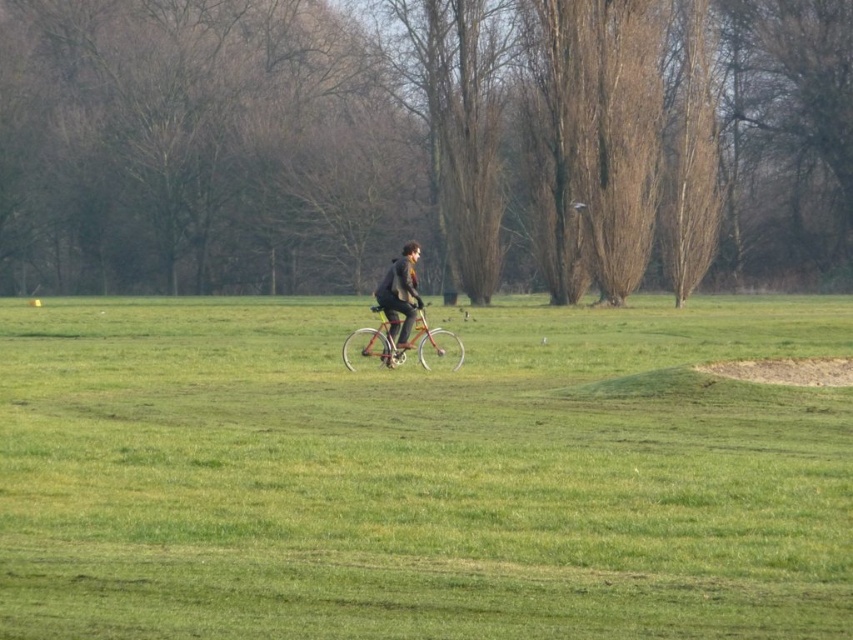
Question: Does green grass at center appear under metallic silver bicycle at center?

Choices:
 (A) no
 (B) yes

Answer: (B)

Question: Which point appears closest to the camera in this image?

Choices:
 (A) (410, 253)
 (B) (102, 326)

Answer: (A)

Question: Which point appears closest to the camera in this image?

Choices:
 (A) [345, 548]
 (B) [415, 292]
 (C) [428, 369]

Answer: (A)

Question: Does metallic silver bicycle at center lie behind dark brown leather jacket at center?

Choices:
 (A) yes
 (B) no

Answer: (B)

Question: Does green grass at center appear under metallic silver bicycle at center?

Choices:
 (A) yes
 (B) no

Answer: (A)

Question: Estimate the real-world distances between objects in this image. Which object is closer to the metallic silver bicycle at center?

Choices:
 (A) green grass at center
 (B) dark brown leather jacket at center

Answer: (B)